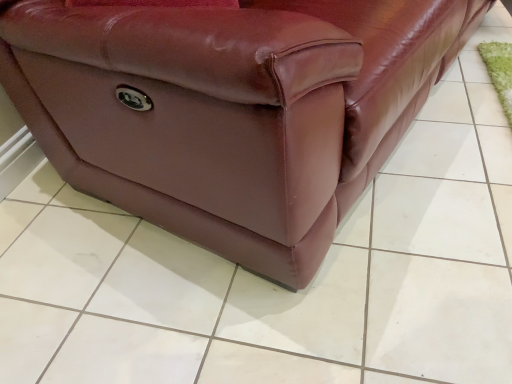
Identify the location of glossy leather couch at center. (230, 110).

The image size is (512, 384). Describe the element at coordinates (230, 110) in the screenshot. I see `glossy leather couch at center` at that location.

At what (x,y) coordinates should I click in order to perform the action: click on glossy leather couch at center. Please return your answer as a coordinate pair (x, y). Looking at the image, I should click on (230, 110).